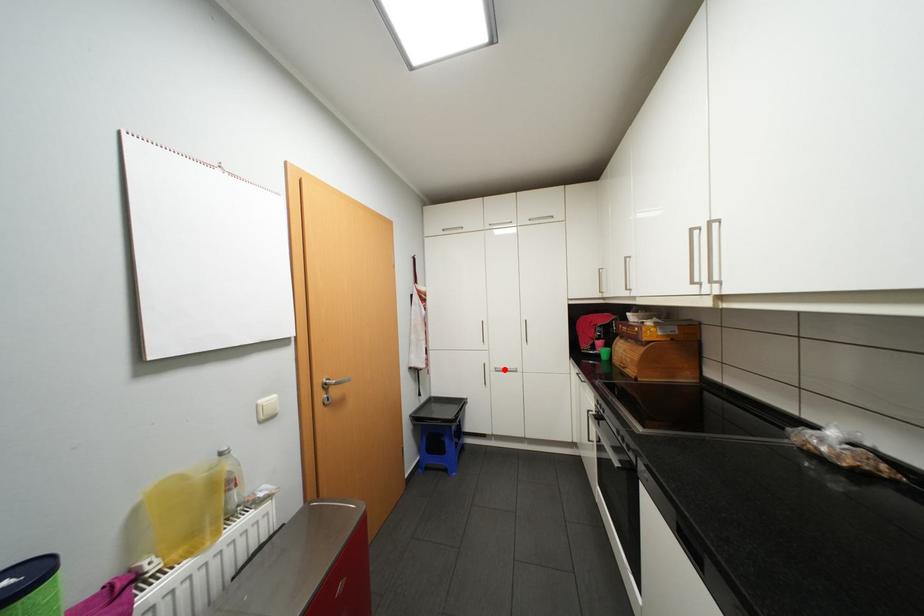
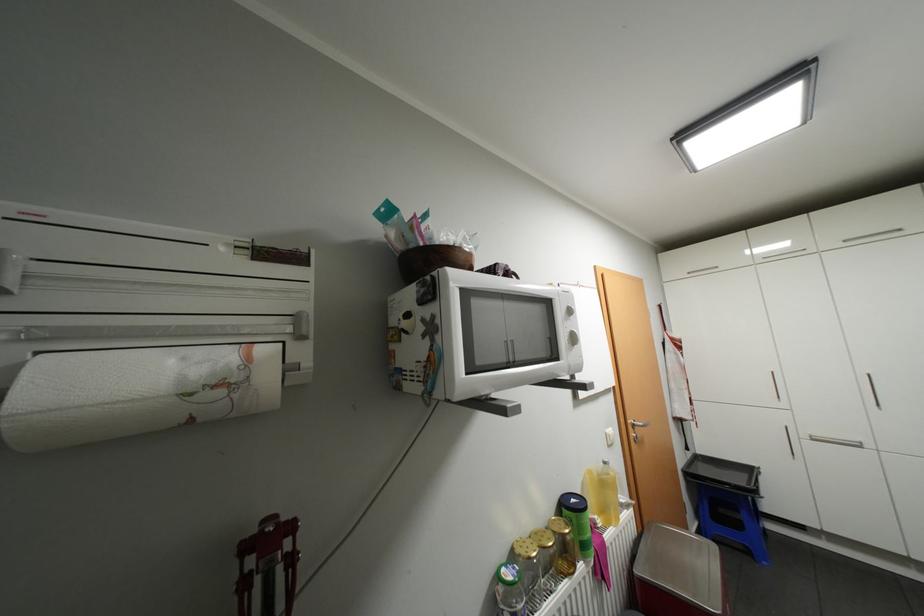
Locate, in the second image, the point that corresponds to the highlighted location in the first image.

(821, 438)